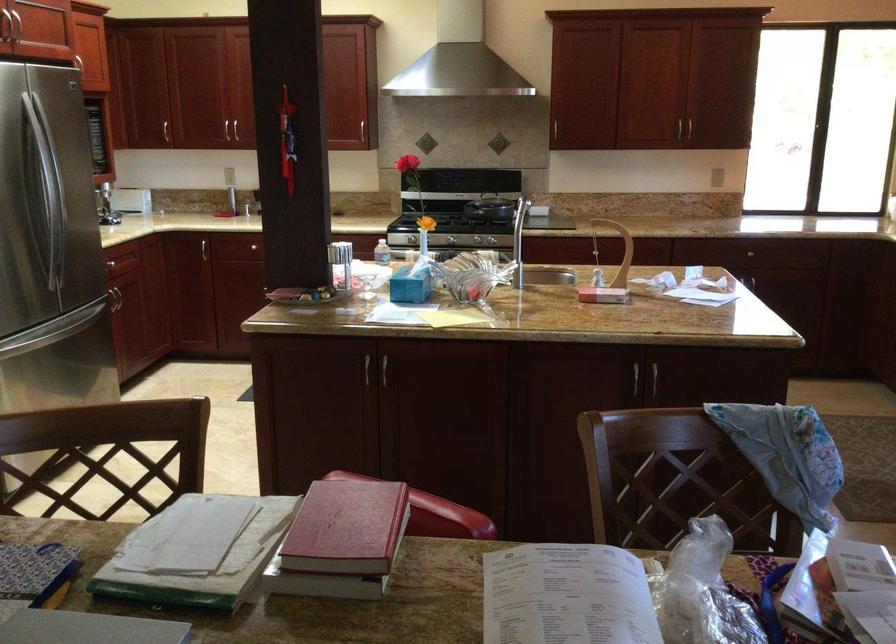
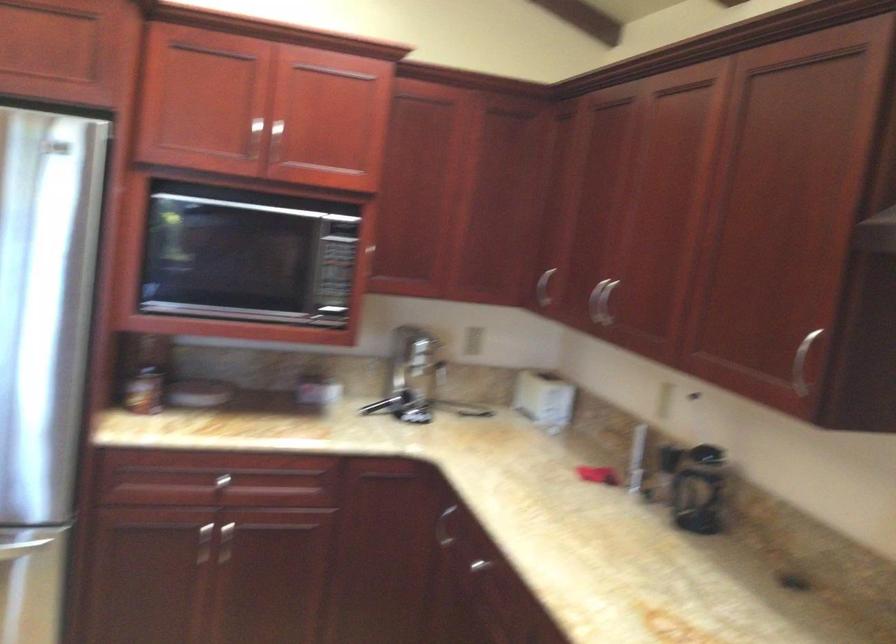
The point at (160, 247) is marked in the first image. Where is the corresponding point in the second image?

(444, 527)